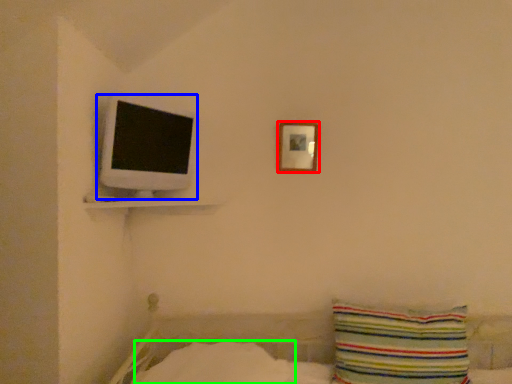
Question: Based on their relative distances, which object is farther from picture frame (highlighted by a red box)? Choose from computer monitor (highlighted by a blue box) and sheet (highlighted by a green box).

Choices:
 (A) computer monitor
 (B) sheet

Answer: (B)